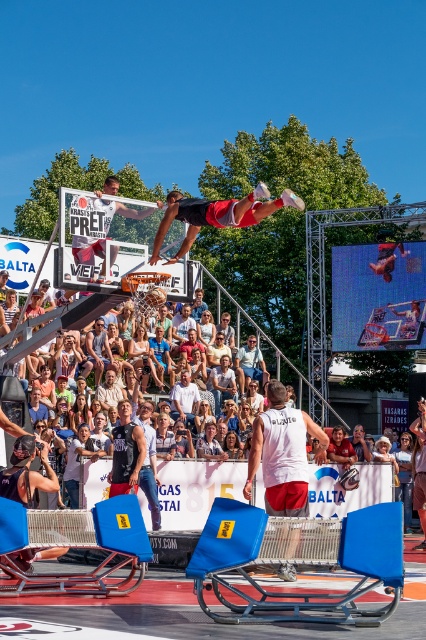
This screenshot has width=426, height=640. Identify the location of white matte tank top at center. (282, 454).

Consider the image. Does white matte tank top at center have a greater height compared to white cotton shirt at center?

Yes.

At what (x,y) coordinates should I click in order to perform the action: click on white matte tank top at center. Please return your answer as a coordinate pair (x, y). Looking at the image, I should click on (282, 454).

What are the coordinates of `white matte tank top at center` in the screenshot? It's located at (282, 454).

Can you confirm if light brown wooden chair at lower right is shorter than light brown leather jacket at center?

Incorrect, light brown wooden chair at lower right's height does not fall short of light brown leather jacket at center's.

Does light brown wooden chair at lower right have a greater height compared to light brown leather jacket at center?

Yes, light brown wooden chair at lower right is taller than light brown leather jacket at center.

Is point (408, 480) positioned after point (351, 464)?

Yes, point (408, 480) is farther from viewer.

The width and height of the screenshot is (426, 640). Identify the location of light brown wooden chair at lower right. (405, 476).

Can you confirm if matte black basketball hoop at center is positioned to the right of white cotton shirt at center?

No, matte black basketball hoop at center is not to the right of white cotton shirt at center.

Between point (100, 204) and point (172, 412), which one is positioned in front?

Point (100, 204) is in front.

Is point (111, 205) less distant than point (196, 408)?

That is True.

This screenshot has width=426, height=640. I want to click on matte black basketball hoop at center, so click(x=117, y=202).